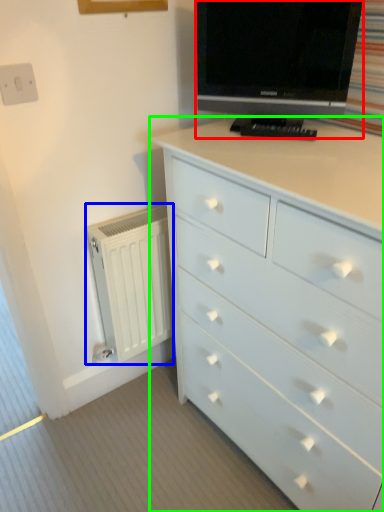
Question: Which object is the farthest from television (highlighted by a red box)? Choose among these: radiator (highlighted by a blue box) or chest of drawers (highlighted by a green box).

Choices:
 (A) radiator
 (B) chest of drawers

Answer: (A)